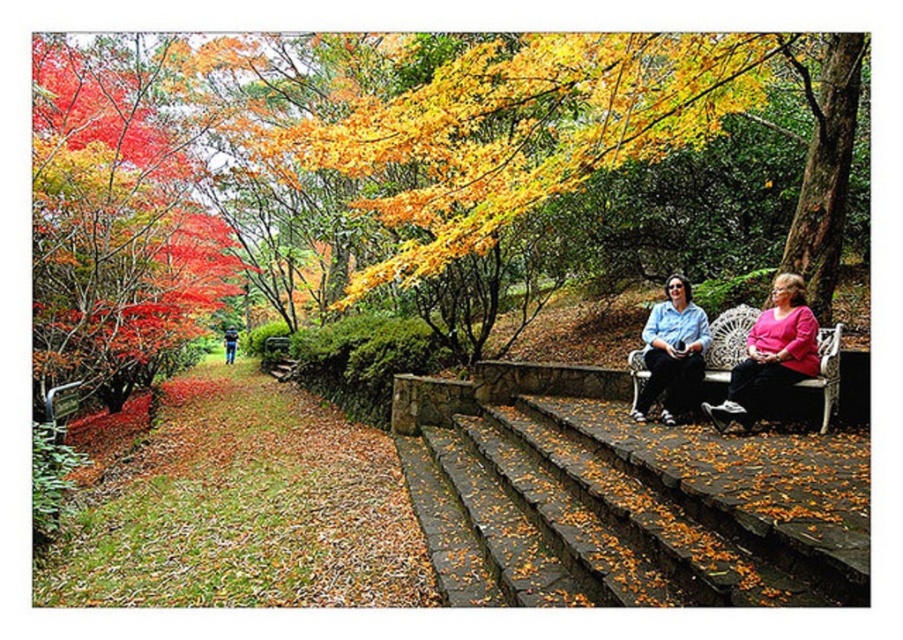
Question: Which of the following is the closest to the observer?

Choices:
 (A) (697, 344)
 (B) (790, 305)

Answer: (B)

Question: Which of the following is the farthest from the observer?

Choices:
 (A) matte pink blouse at center
 (B) matte blue shirt at center
 (C) stone steps at center
 (D) blue jeans at lower left

Answer: (D)

Question: Does stone steps at center appear over blue jeans at lower left?

Choices:
 (A) no
 (B) yes

Answer: (A)

Question: Can you confirm if stone steps at center is positioned above blue jeans at lower left?

Choices:
 (A) no
 (B) yes

Answer: (A)

Question: Does matte pink blouse at center have a smaller size compared to blue jeans at lower left?

Choices:
 (A) no
 (B) yes

Answer: (A)

Question: Which of the following is the farthest from the observer?

Choices:
 (A) stone steps at center
 (B) matte blue shirt at center
 (C) matte pink blouse at center
 (D) blue jeans at lower left

Answer: (D)